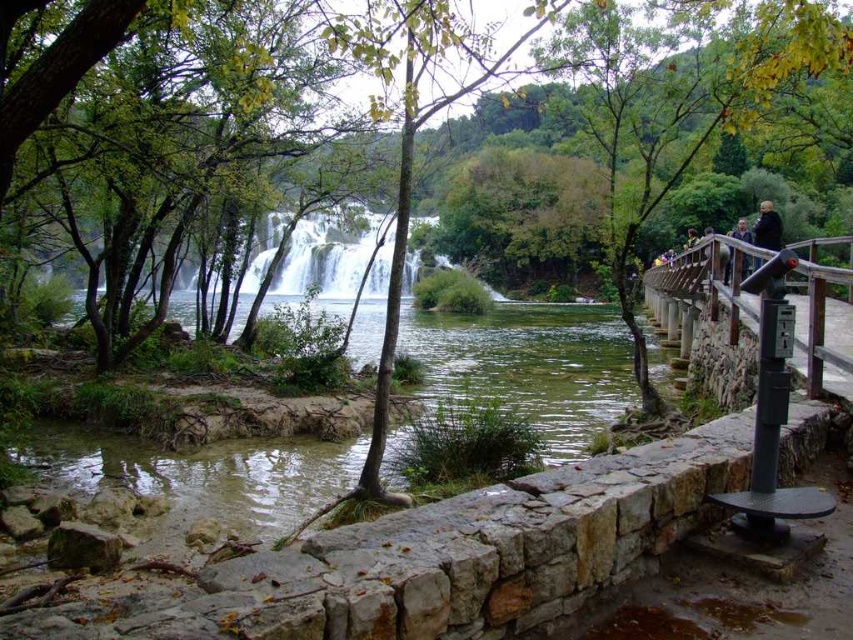
You are a photographer standing at the stone wall near the railing. You want to capture a photo of the white frothy water at center and the golden hair at upper right in the same frame. Which object should you focus on first if you want to ensure both are in focus?

The white frothy water at center has a lesser height compared to golden hair at upper right, so you should focus on the golden hair at upper right first since it is farther away to ensure both are in focus.

You are standing at the stone wall near the railing and want to look at the two points in the scene. Which point is closer to you, point (474, 371) or point (735, 269)?

Point (735, 269) is closer to you because point (474, 371) is behind it.

Looking at this image, you are a visitor standing at the stone wall near the brown wooden railing at right and dark brown leather jacket at upper right. You want to place your backpack on the ground between these two items. Is there enough space between them to place your backpack?

The brown wooden railing at right is to the left of dark brown leather jacket at upper right, so there is space between them. You can place your backpack on the ground between the brown wooden railing at right and the dark brown leather jacket at upper right.